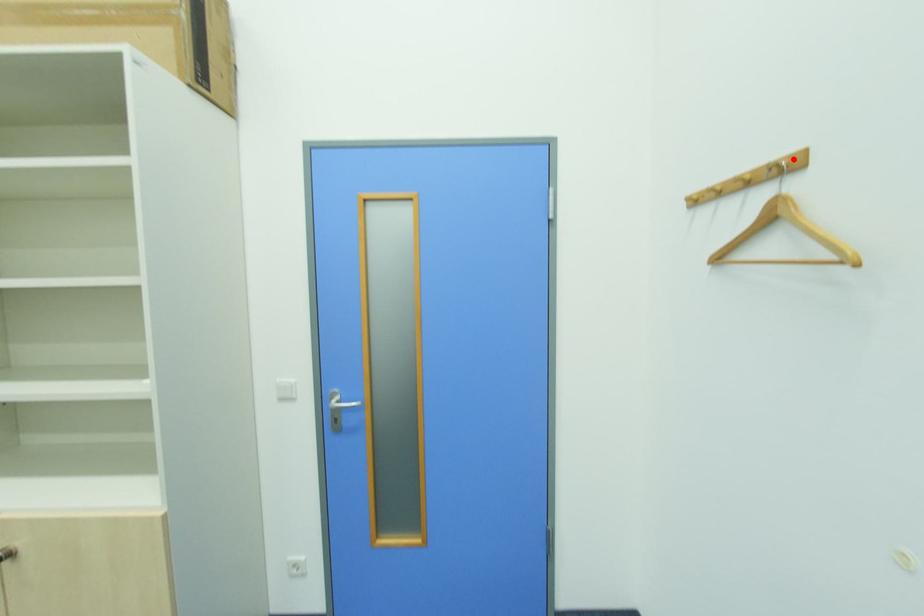
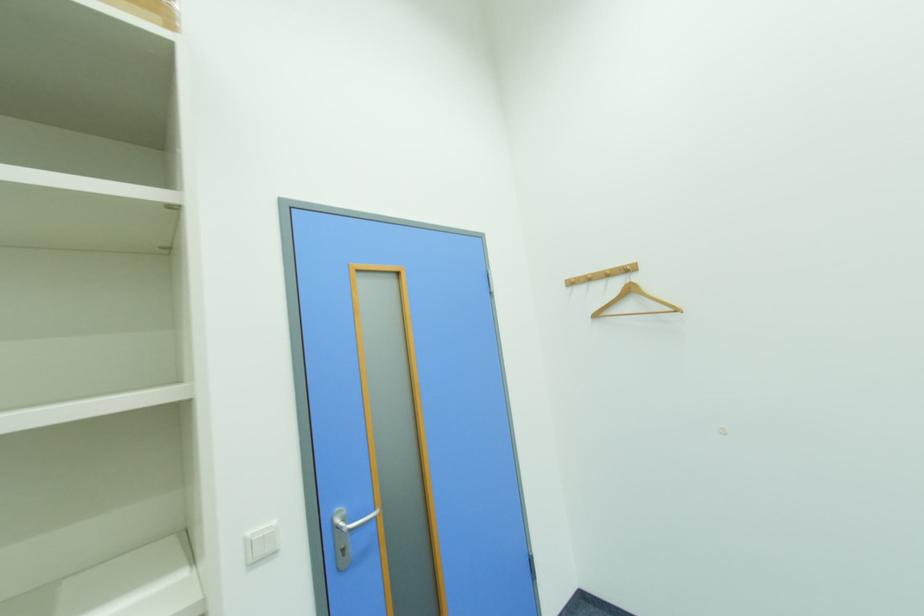
Where in the second image is the point corresponding to the highlighted location from the first image?

(634, 267)